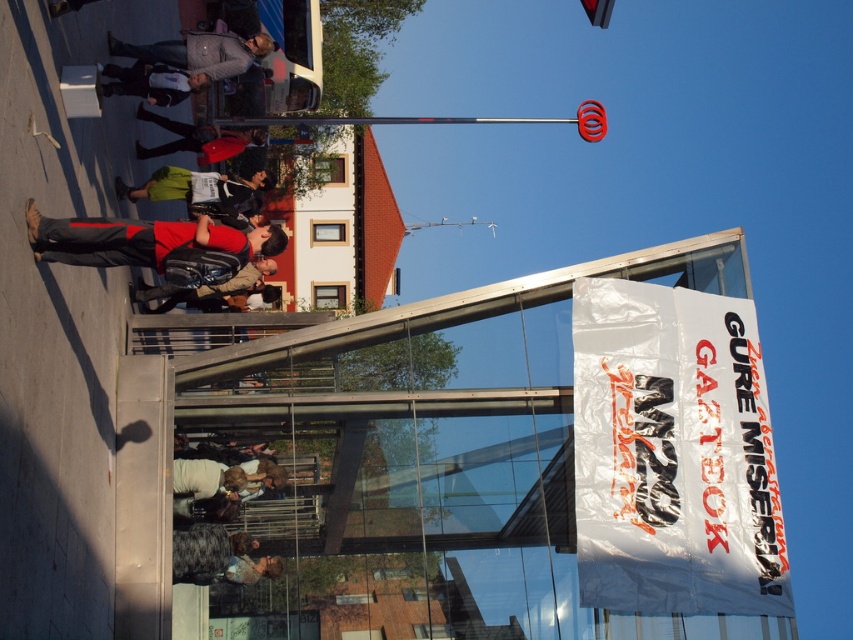
Question: Which point appears closest to the camera in this image?

Choices:
 (A) (39, 250)
 (B) (167, 195)
 (C) (231, 54)

Answer: (A)

Question: Can you confirm if matte black backpack at center is wider than dark gray jacket at center?

Choices:
 (A) yes
 (B) no

Answer: (A)

Question: Is gray fabric jacket at upper center to the left of matte black backpack at center from the viewer's perspective?

Choices:
 (A) no
 (B) yes

Answer: (A)

Question: Which object is closer to the camera taking this photo?

Choices:
 (A) matte black backpack at center
 (B) matte red shirt at center

Answer: (B)

Question: Based on their relative distances, which object is farther from the matte red shirt at center?

Choices:
 (A) matte black backpack at center
 (B) white crumpled paper banner at upper center
 (C) dark gray jacket at center
 (D) green fabric jacket at center

Answer: (A)

Question: Can you confirm if gray fabric jacket at upper center is wider than matte black backpack at center?

Choices:
 (A) no
 (B) yes

Answer: (B)